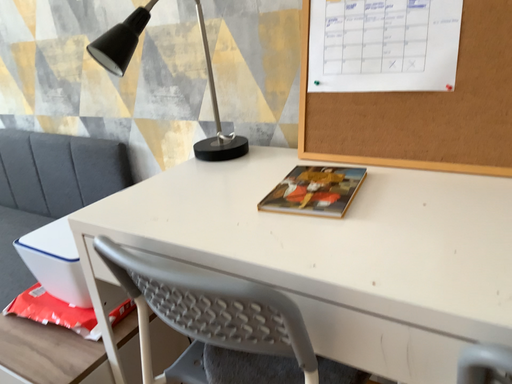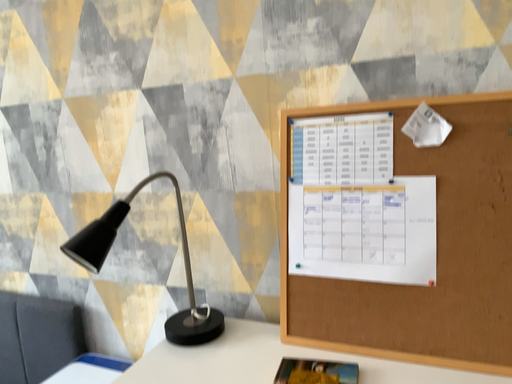
Question: How did the camera likely rotate when shooting the video?

Choices:
 (A) rotated left
 (B) rotated right

Answer: (B)